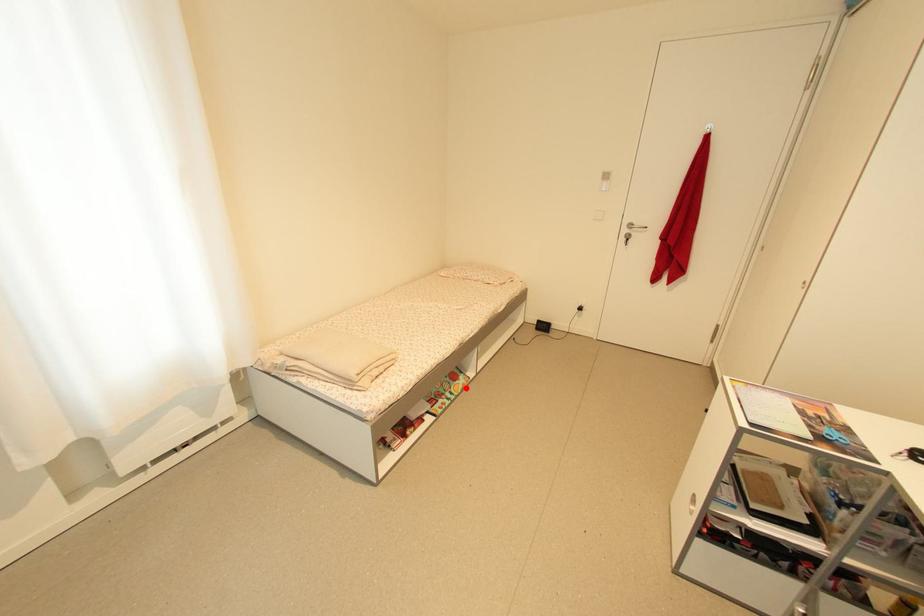
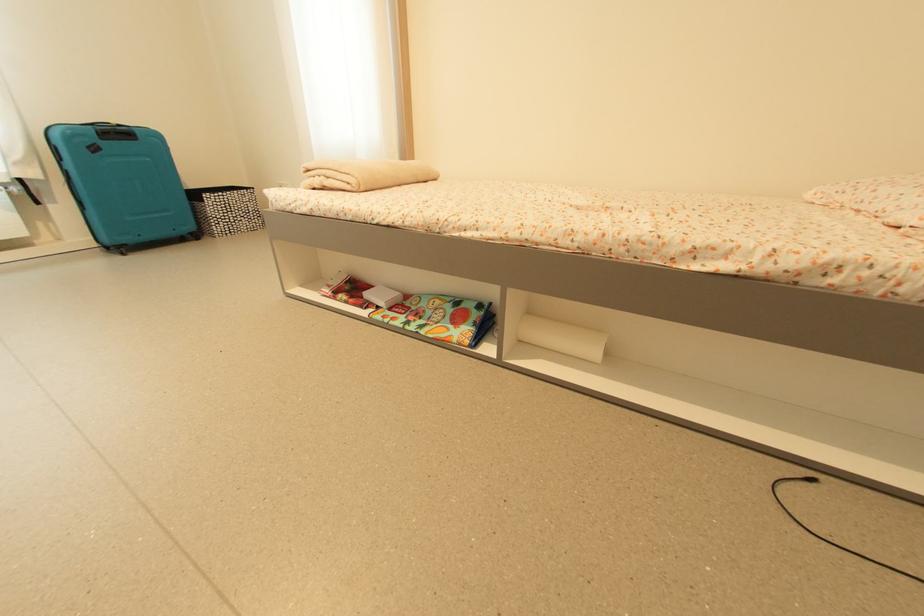
Question: I am providing you with two images of the same scene from different viewpoints. In image1, a red point is highlighted. Considering the same 3D point in image2, which of the following is correct?

Choices:
 (A) It is closer
 (B) It is farther

Answer: (A)